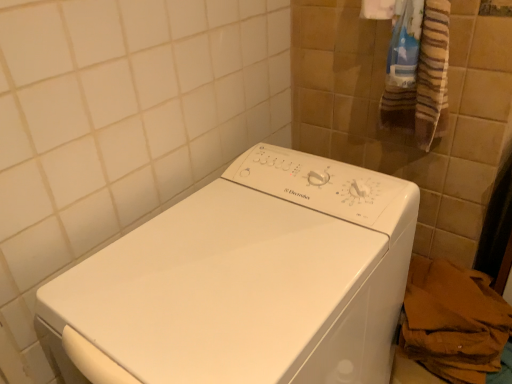
Question: Relative to white glossy washing machine at center, is brown paper bag at lower right in front or behind?

Choices:
 (A) front
 (B) behind

Answer: (B)

Question: From a real-world perspective, is brown paper bag at lower right above or below white glossy washing machine at center?

Choices:
 (A) above
 (B) below

Answer: (B)

Question: Which object is the closest to the brown paper bag at lower right?

Choices:
 (A) striped cotton bath towel at upper right
 (B) white glossy washing machine at center

Answer: (B)

Question: Which object is positioned farthest from the striped cotton bath towel at upper right?

Choices:
 (A) white glossy washing machine at center
 (B) brown paper bag at lower right

Answer: (A)